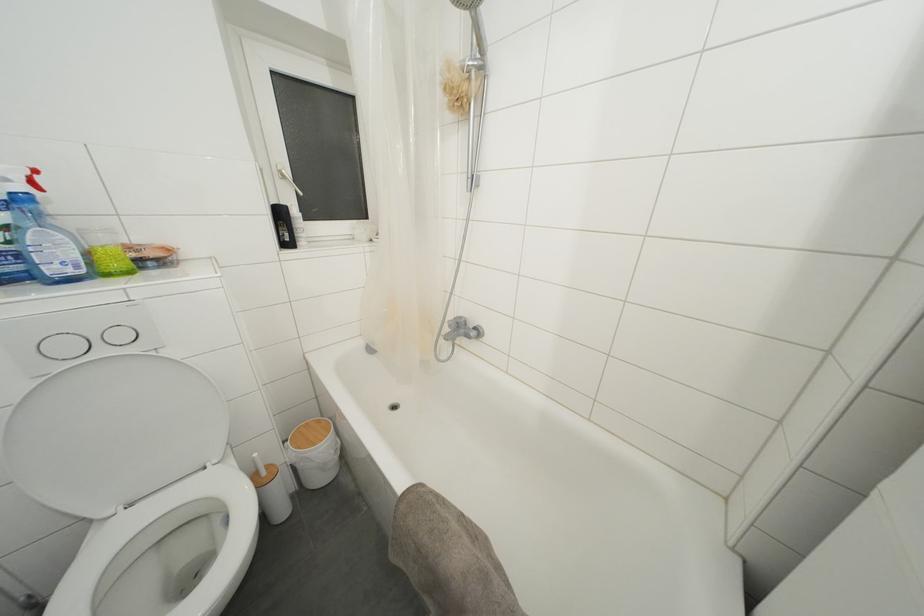
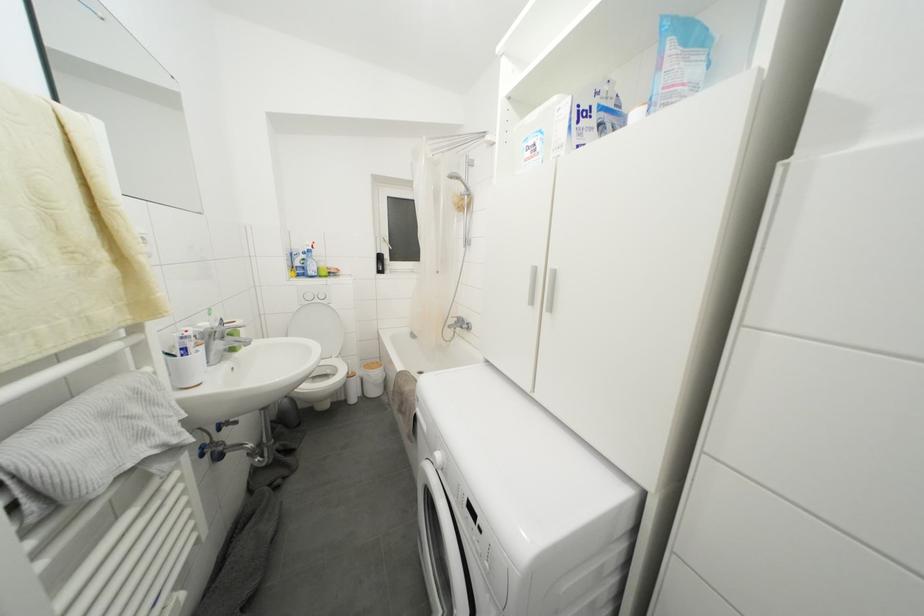
Which direction would the cameraman need to move to produce the second image?

The cameraman walked toward right, backward.